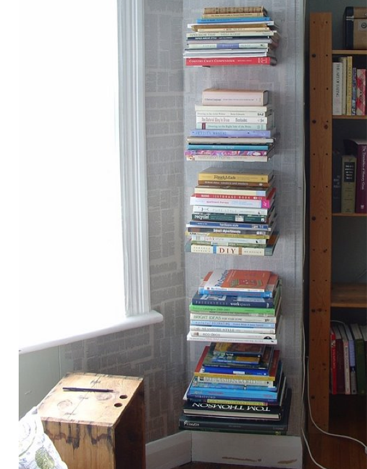
You are a GUI agent. You are given a task and a screenshot of the screen. Output one action in this format:
    pyautogui.click(x=<x>, y=<y>)
    Task: Click on the wooden crate
    The image size is (367, 469).
    Given the screenshot: What is the action you would take?
    pyautogui.click(x=98, y=402)